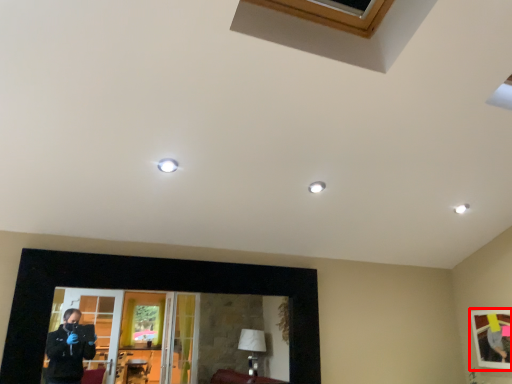
Question: From the image's perspective, what is the correct spatial relationship of picture frame (annotated by the red box) in relation to picture frame?

Choices:
 (A) above
 (B) below

Answer: (B)